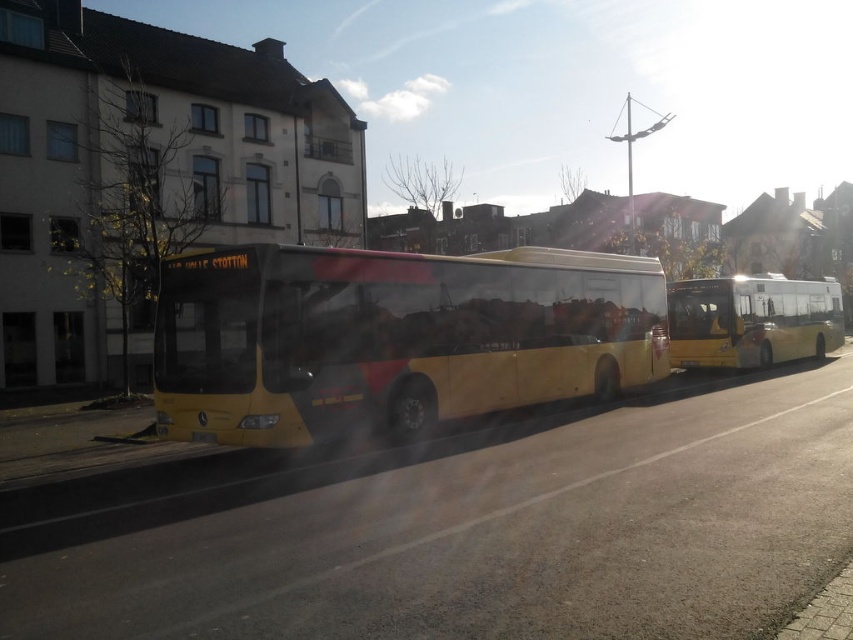
You are a pedestrian standing on the sidewalk and see both the yellow matte bus at center and the yellow metallic bus at right. Which bus appears closer to you based on their sizes?

The yellow matte bus at center appears closer because it has a smaller size compared to the yellow metallic bus at right, which is larger and farther away.

You are a pedestrian standing at the crosswalk and see the yellow matte bus at center and the yellow metallic bus at right. Which bus is closer to your left side?

The yellow matte bus at center is to the left of the yellow metallic bus at right, so the yellow matte bus at center is closer to your left side.

You are standing at the center of the image and want to find the yellow matte bus at center. According to the coordinates provided in the Objects Description, is the bus closer to the top or bottom of the image?

The yellow matte bus at center is located at point coordinates with a y value of 0.461. Since the y value is closer to 0.5, which is the center of the image, it is equally distant from the top and bottom. However, since 0.461 is slightly less than 0.5, it is very slightly closer to the bottom than the top.